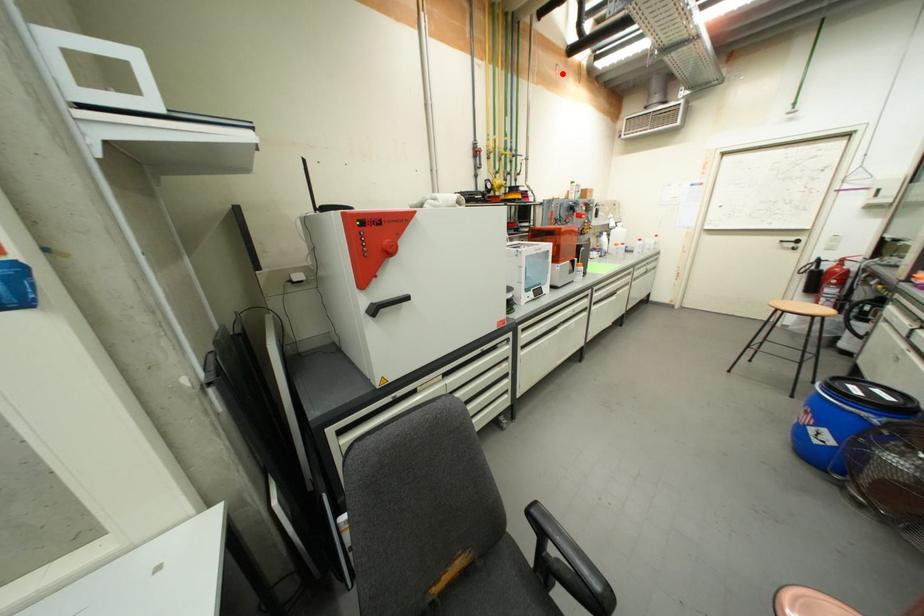
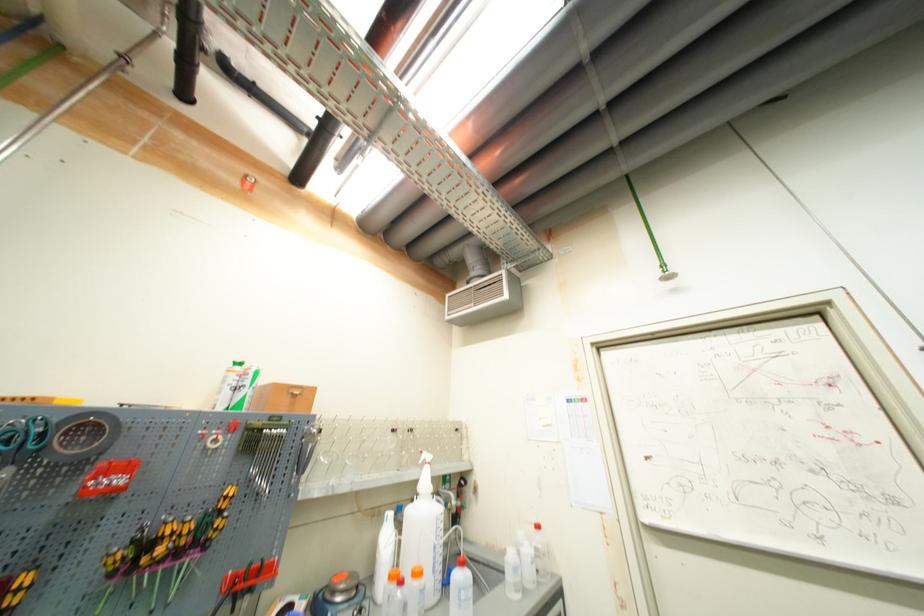
Where in the second image is the point corresponding to the highlighted location from the first image?

(253, 185)